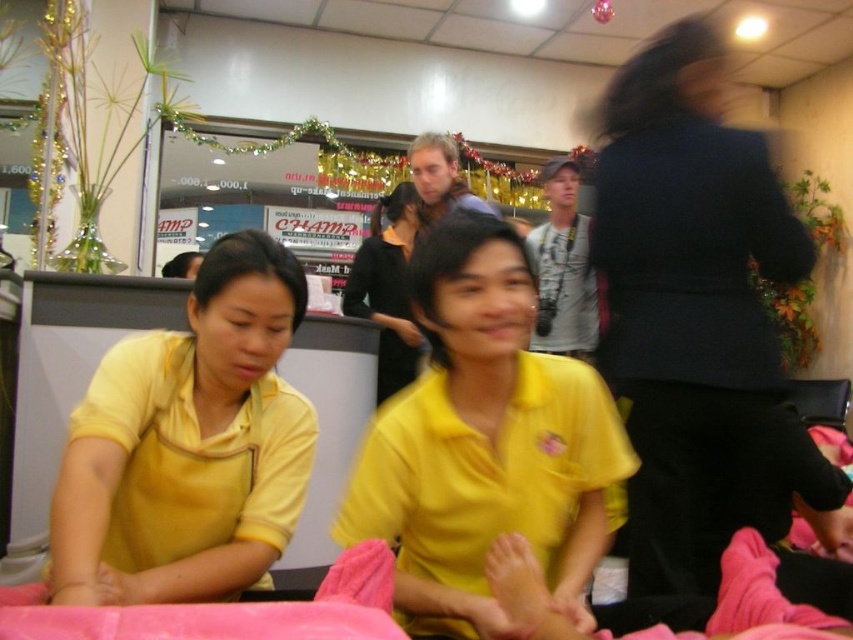
Question: Is yellow matte shirt at center smaller than yellow matte shirt at left?

Choices:
 (A) yes
 (B) no

Answer: (B)

Question: Which point is farther to the camera?

Choices:
 (A) (73, 477)
 (B) (718, 227)
 (C) (509, 276)

Answer: (B)

Question: Is black matte jacket at upper right positioned before matte black shirt at center?

Choices:
 (A) no
 (B) yes

Answer: (B)

Question: Estimate the real-world distances between objects in this image. Which object is closer to the yellow matte shirt at left?

Choices:
 (A) black matte jacket at upper right
 (B) yellow matte shirt at center

Answer: (B)

Question: Which of the following is the farthest from the observer?

Choices:
 (A) matte black shirt at center
 (B) yellow matte shirt at center
 (C) black matte jacket at upper right
 (D) yellow matte shirt at left

Answer: (A)

Question: Does yellow matte shirt at left appear over matte black shirt at center?

Choices:
 (A) yes
 (B) no

Answer: (B)